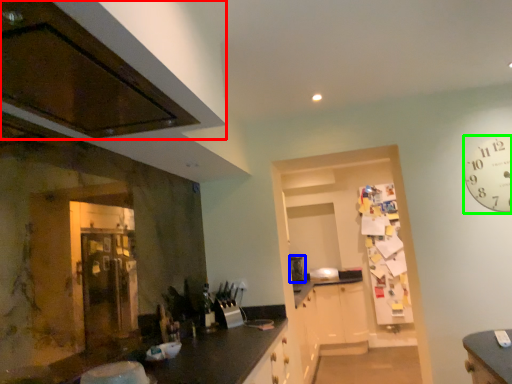
Question: Estimate the real-world distances between objects in this image. Which object is closer to cabinetry (highlighted by a red box), appliance (highlighted by a blue box) or clock (highlighted by a green box)?

Choices:
 (A) appliance
 (B) clock

Answer: (B)